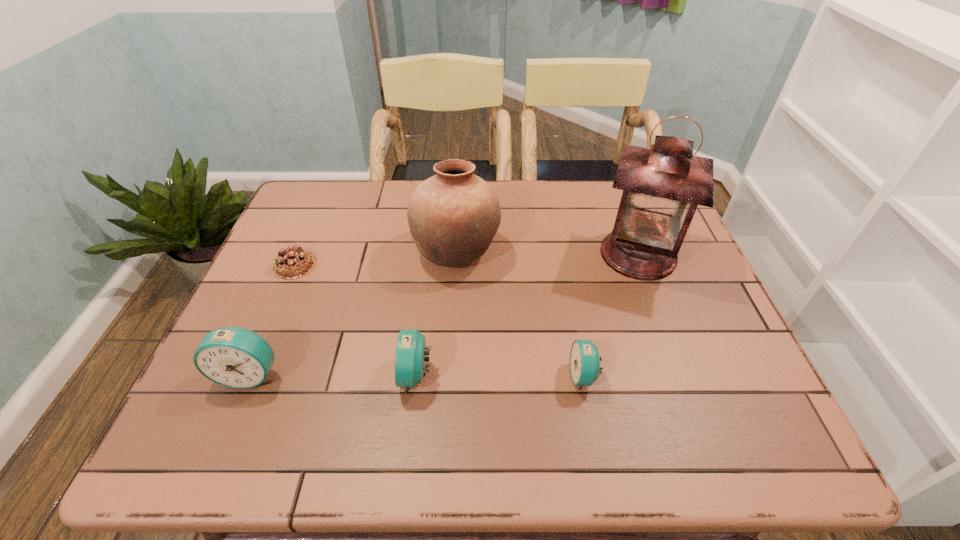
In the current image, all alarm clocks are evenly spaced. To maintain this equal spacing, where should an additional alarm clock be placed on the right? Please point out a free spot. Please provide its 2D coordinates. Your answer should be formatted as a tuple, i.e. [(x, y)], where the tuple contains the x and y coordinates of a point satisfying the conditions above.

[(751, 377)]